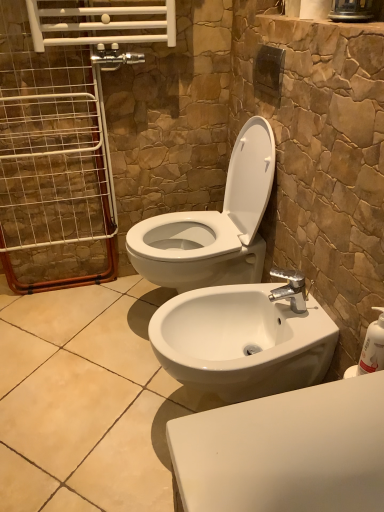
Question: From the image's perspective, does white glossy toilet at center appear higher than white plastic soap dispenser at right?

Choices:
 (A) no
 (B) yes

Answer: (B)

Question: Considering the relative sizes of white glossy toilet at center and white plastic soap dispenser at right in the image provided, is white glossy toilet at center shorter than white plastic soap dispenser at right?

Choices:
 (A) yes
 (B) no

Answer: (B)

Question: From the image's perspective, does white glossy toilet at center appear lower than white plastic soap dispenser at right?

Choices:
 (A) yes
 (B) no

Answer: (B)

Question: Does white glossy toilet at center turn towards white plastic soap dispenser at right?

Choices:
 (A) yes
 (B) no

Answer: (B)

Question: Considering the relative sizes of white glossy toilet at center and white plastic soap dispenser at right in the image provided, is white glossy toilet at center thinner than white plastic soap dispenser at right?

Choices:
 (A) no
 (B) yes

Answer: (A)

Question: Is white glossy toilet at center in front of or behind white wire screen door at left in the image?

Choices:
 (A) behind
 (B) front

Answer: (B)

Question: Considering the positions of white glossy toilet at center and white wire screen door at left in the image, is white glossy toilet at center bigger or smaller than white wire screen door at left?

Choices:
 (A) small
 (B) big

Answer: (B)

Question: Is point (240, 132) closer or farther from the camera than point (14, 80)?

Choices:
 (A) closer
 (B) farther

Answer: (B)

Question: From a real-world perspective, relative to white wire screen door at left, is white glossy toilet at center vertically above or below?

Choices:
 (A) above
 (B) below

Answer: (B)

Question: Does point (367, 364) appear closer or farther from the camera than point (16, 190)?

Choices:
 (A) farther
 (B) closer

Answer: (B)

Question: Considering the positions of white plastic soap dispenser at right and white wire screen door at left in the image, is white plastic soap dispenser at right wider or thinner than white wire screen door at left?

Choices:
 (A) thin
 (B) wide

Answer: (A)

Question: In terms of size, does white plastic soap dispenser at right appear bigger or smaller than white wire screen door at left?

Choices:
 (A) small
 (B) big

Answer: (A)

Question: Is white plastic soap dispenser at right situated inside white wire screen door at left or outside?

Choices:
 (A) inside
 (B) outside

Answer: (B)

Question: From their relative heights in the image, would you say white glossy sink at lower center is taller or shorter than white glossy toilet at center?

Choices:
 (A) short
 (B) tall

Answer: (A)

Question: Would you say white glossy sink at lower center is to the left or to the right of white glossy toilet at center in the picture?

Choices:
 (A) right
 (B) left

Answer: (A)